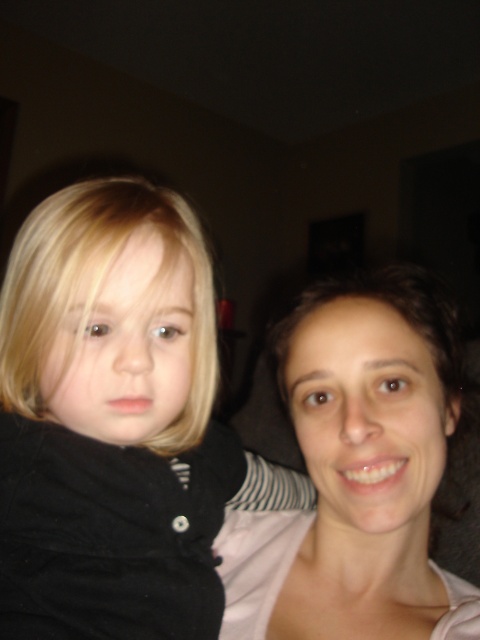
Does black cotton shirt at left have a greater height compared to smooth skin face at center?

Yes.

Which of these two, black cotton shirt at left or smooth skin face at center, stands taller?

black cotton shirt at left is taller.

Which is in front, point (4, 632) or point (336, 310)?

Point (4, 632)

Where is `black cotton shirt at left`? black cotton shirt at left is located at coordinates (116, 420).